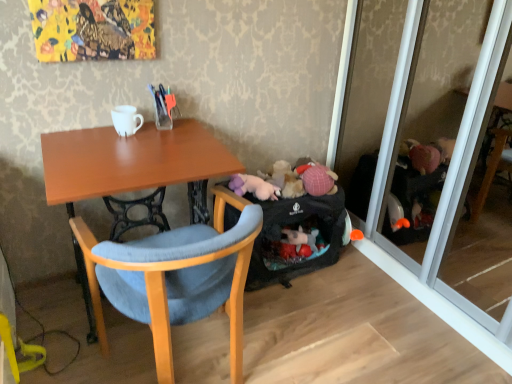
Question: Is wooden chair at center positioned behind white glossy coffee cup at upper center?

Choices:
 (A) no
 (B) yes

Answer: (A)

Question: Is wooden chair at center facing towards white glossy coffee cup at upper center?

Choices:
 (A) yes
 (B) no

Answer: (A)

Question: Can you confirm if wooden chair at center is positioned to the right of white glossy coffee cup at upper center?

Choices:
 (A) yes
 (B) no

Answer: (A)

Question: Considering the relative sizes of wooden chair at center and white glossy coffee cup at upper center in the image provided, is wooden chair at center thinner than white glossy coffee cup at upper center?

Choices:
 (A) no
 (B) yes

Answer: (A)

Question: Considering the relative sizes of wooden chair at center and white glossy coffee cup at upper center in the image provided, is wooden chair at center shorter than white glossy coffee cup at upper center?

Choices:
 (A) no
 (B) yes

Answer: (A)

Question: Is point (145, 248) positioned closer to the camera than point (284, 273)?

Choices:
 (A) farther
 (B) closer

Answer: (B)

Question: From a real-world perspective, is wooden chair at center physically located above or below black fabric luggage at lower right?

Choices:
 (A) below
 (B) above

Answer: (B)

Question: Considering the positions of wooden chair at center and black fabric luggage at lower right in the image, is wooden chair at center taller or shorter than black fabric luggage at lower right?

Choices:
 (A) short
 (B) tall

Answer: (B)

Question: Considering the positions of wooden chair at center and black fabric luggage at lower right in the image, is wooden chair at center wider or thinner than black fabric luggage at lower right?

Choices:
 (A) thin
 (B) wide

Answer: (B)

Question: Is point (339, 251) closer or farther from the camera than point (234, 233)?

Choices:
 (A) closer
 (B) farther

Answer: (B)

Question: From a real-world perspective, is black fabric luggage at lower right above or below wooden chair at center?

Choices:
 (A) below
 (B) above

Answer: (A)

Question: In terms of size, does black fabric luggage at lower right appear bigger or smaller than wooden chair at center?

Choices:
 (A) small
 (B) big

Answer: (A)

Question: From the image's perspective, is black fabric luggage at lower right located above or below wooden chair at center?

Choices:
 (A) above
 (B) below

Answer: (A)

Question: From a real-world perspective, relative to black fabric luggage at lower right, is transparent glass screen door at right vertically above or below?

Choices:
 (A) below
 (B) above

Answer: (B)

Question: Looking at their shapes, would you say transparent glass screen door at right is wider or thinner than black fabric luggage at lower right?

Choices:
 (A) wide
 (B) thin

Answer: (A)